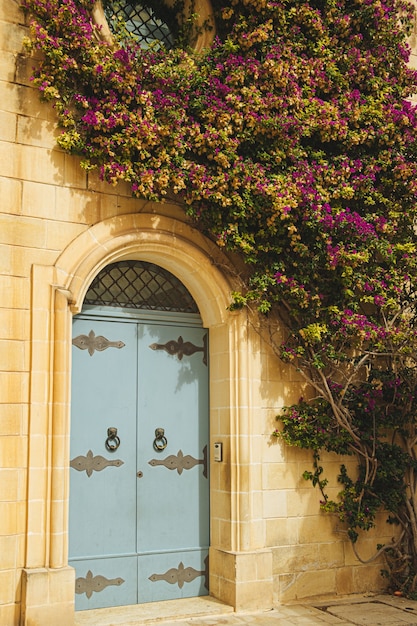
Find the location of a particular element. top of doorway arch is located at coordinates (151, 237).